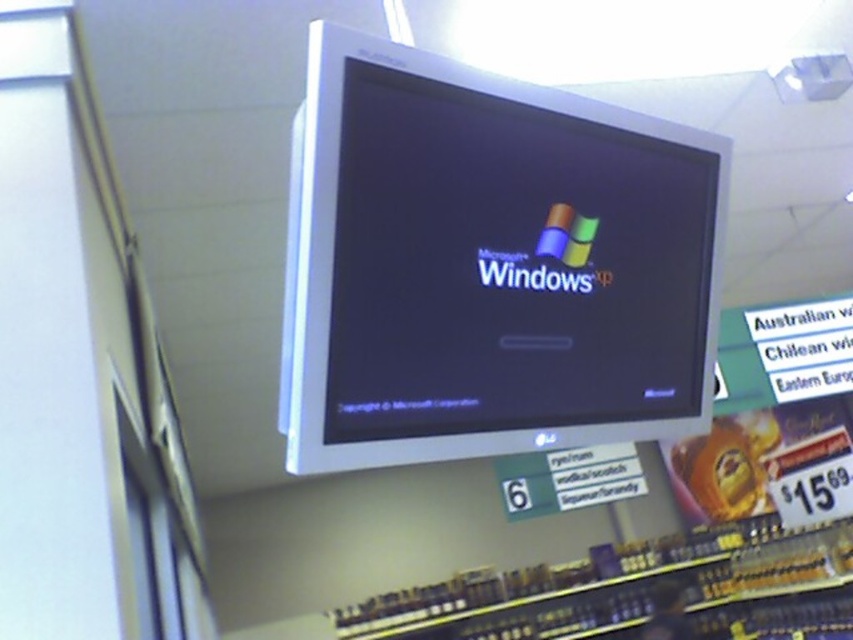
Question: Which point is farther from the camera taking this photo?

Choices:
 (A) (538, 636)
 (B) (305, 216)

Answer: (A)

Question: From the image, what is the correct spatial relationship of satin silver monitor at center in relation to metallic silver shelves at lower center?

Choices:
 (A) left
 (B) right

Answer: (A)

Question: Is satin silver monitor at center bigger than metallic silver shelves at lower center?

Choices:
 (A) no
 (B) yes

Answer: (A)

Question: Which point is closer to the camera?

Choices:
 (A) (393, 637)
 (B) (451, 268)

Answer: (B)

Question: Is satin silver monitor at center in front of metallic silver shelves at lower center?

Choices:
 (A) yes
 (B) no

Answer: (A)

Question: Which of the following is the closest to the observer?

Choices:
 (A) metallic silver shelves at lower center
 (B) satin silver monitor at center

Answer: (B)